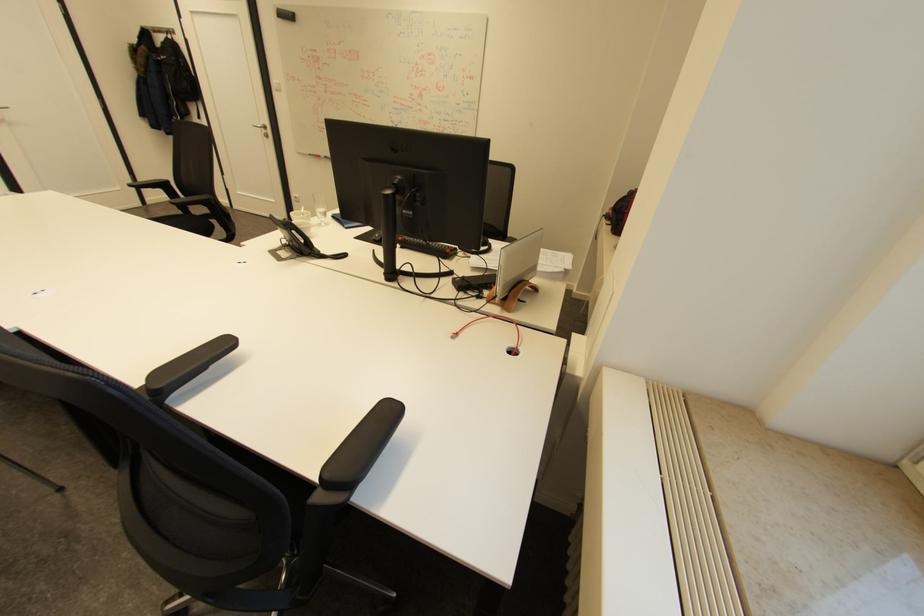
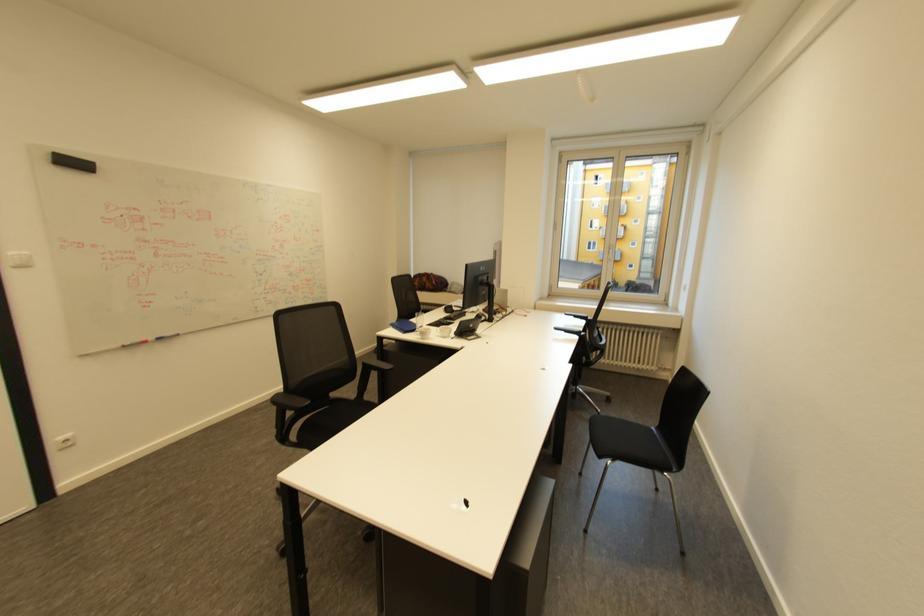
Where in the second image is the point corresponding to (x=315, y=154) from the first image?

(128, 346)